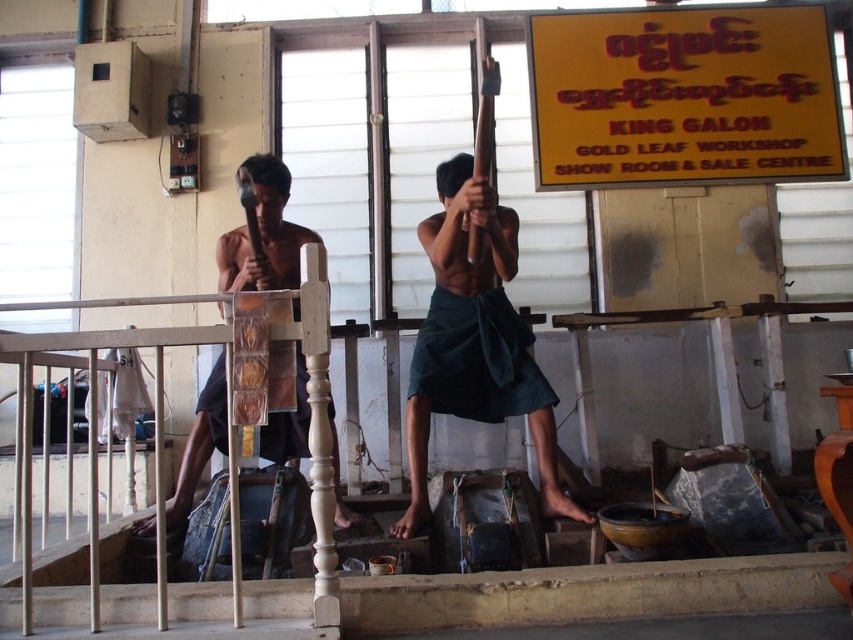
You are a customer entering the gold leaf workshop and see the yellow paper sign at upper right and the green fabric at center. Which object is located more to the right side?

The yellow paper sign at upper right is positioned on the right side of the green fabric at center, so it is more to the right.

You are a customer entering the gold leaf workshop and see the yellow paper sign at upper right and the dark green fabric at center. Which object is positioned to the right side of the other?

The yellow paper sign at upper right is to the right of dark green fabric at center.